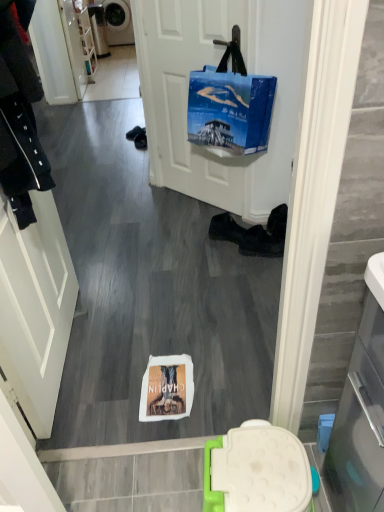
Identify the location of free spot in front of white matte door at center. Image resolution: width=384 pixels, height=512 pixels. (177, 228).